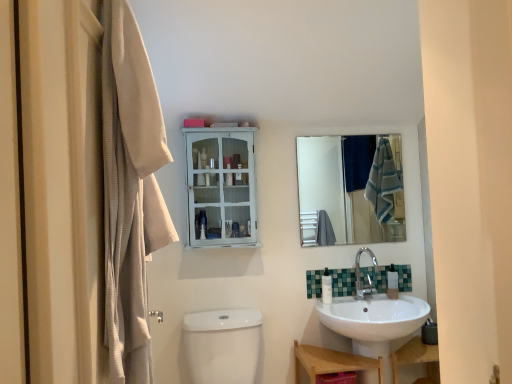
Question: Is white painted wood cabinet at upper center not inside wooden shelf at lower right?

Choices:
 (A) yes
 (B) no

Answer: (A)

Question: Considering the relative positions of white painted wood cabinet at upper center and wooden shelf at lower right in the image provided, is white painted wood cabinet at upper center to the right of wooden shelf at lower right from the viewer's perspective?

Choices:
 (A) no
 (B) yes

Answer: (A)

Question: Would you say white painted wood cabinet at upper center contains wooden shelf at lower right?

Choices:
 (A) yes
 (B) no

Answer: (B)

Question: From the image's perspective, does white painted wood cabinet at upper center appear lower than wooden shelf at lower right?

Choices:
 (A) yes
 (B) no

Answer: (B)

Question: Is white painted wood cabinet at upper center further to camera compared to wooden shelf at lower right?

Choices:
 (A) no
 (B) yes

Answer: (B)

Question: Looking at the image, does white glossy toilet bowl at lower center seem bigger or smaller compared to white painted wood cabinet at upper center?

Choices:
 (A) small
 (B) big

Answer: (B)

Question: From the image's perspective, is white glossy toilet bowl at lower center positioned above or below white painted wood cabinet at upper center?

Choices:
 (A) below
 (B) above

Answer: (A)

Question: Is white glossy toilet bowl at lower center inside or outside of white painted wood cabinet at upper center?

Choices:
 (A) inside
 (B) outside

Answer: (B)

Question: From a real-world perspective, is white glossy toilet bowl at lower center positioned above or below white painted wood cabinet at upper center?

Choices:
 (A) below
 (B) above

Answer: (A)

Question: In terms of width, does metallic silver faucet at lower center look wider or thinner when compared to white glossy soap dispenser at lower center, which ranks as the second toiletry in right-to-left order?

Choices:
 (A) thin
 (B) wide

Answer: (A)

Question: Choose the correct answer: Is metallic silver faucet at lower center inside white glossy soap dispenser at lower center, which ranks as the second toiletry in right-to-left order, or outside it?

Choices:
 (A) inside
 (B) outside

Answer: (B)

Question: Based on their sizes in the image, would you say metallic silver faucet at lower center is bigger or smaller than white glossy soap dispenser at lower center, which ranks as the second toiletry in right-to-left order?

Choices:
 (A) big
 (B) small

Answer: (A)

Question: In terms of height, does metallic silver faucet at lower center look taller or shorter compared to white glossy soap dispenser at lower center, which ranks as the second toiletry in right-to-left order?

Choices:
 (A) tall
 (B) short

Answer: (B)

Question: Considering the positions of clear glass mirror at upper center and white painted wood cabinet at upper center in the image, is clear glass mirror at upper center wider or thinner than white painted wood cabinet at upper center?

Choices:
 (A) wide
 (B) thin

Answer: (B)

Question: Considering their positions, is clear glass mirror at upper center located in front of or behind white painted wood cabinet at upper center?

Choices:
 (A) behind
 (B) front

Answer: (A)